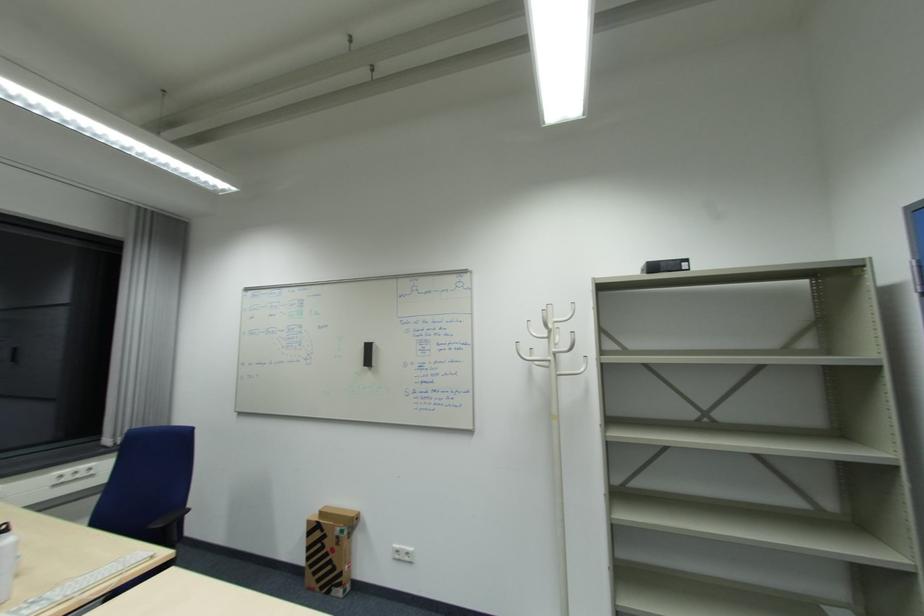
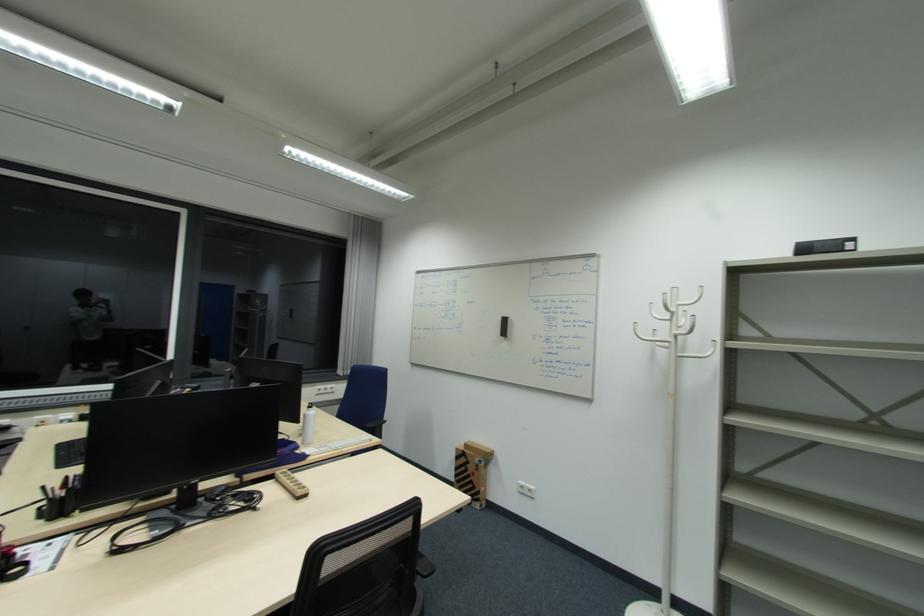
Question: Based on the continuous images, in which direction is the camera rotating? Reply with the corresponding letter.

Choices:
 (A) Left
 (B) Right
 (C) Up
 (D) Down

Answer: (A)